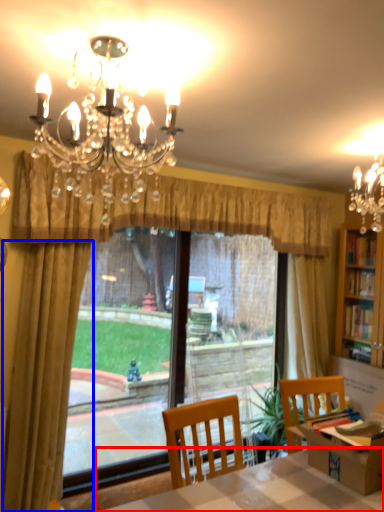
Question: Among these objects, which one is farthest to the camera, table (highlighted by a red box) or curtain (highlighted by a blue box)?

Choices:
 (A) table
 (B) curtain

Answer: (B)